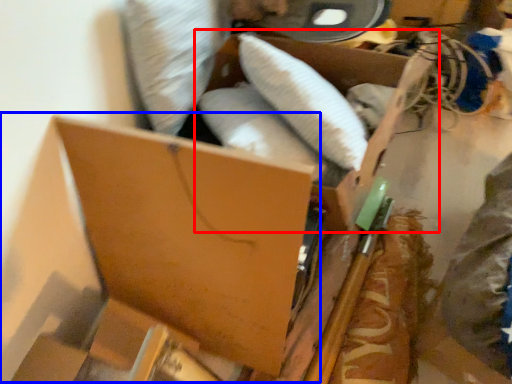
Question: Which point is further to the camera, storage box (highlighted by a red box) or storage box (highlighted by a blue box)?

Choices:
 (A) storage box
 (B) storage box

Answer: (A)